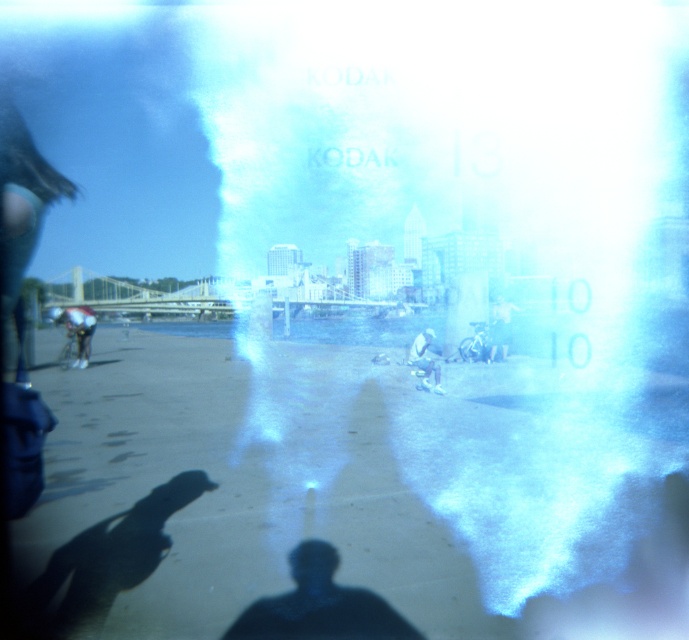
You are a photographer standing on the beach and want to capture both the dark blue fabric cyclist at left and the white plastic bag at center in a single shot. Which object should you focus on first if you want the larger one to be in sharp focus?

The dark blue fabric cyclist at left is bigger than the white plastic bag at center, so you should focus on the dark blue fabric cyclist at left first to ensure it is in sharp focus.